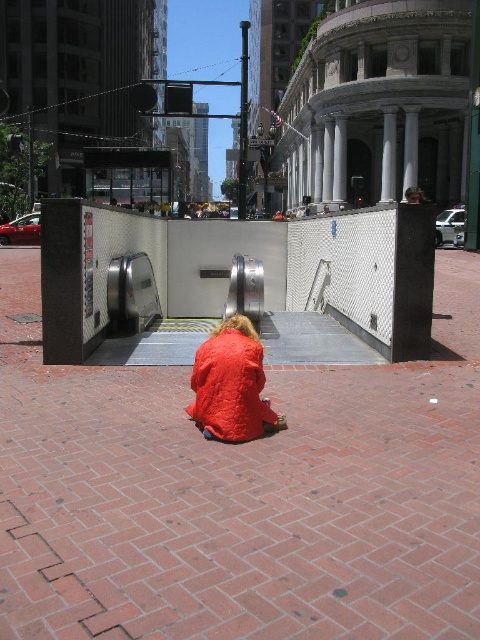
Which is below, brick pavement at center or quilted orange coat at center?

Positioned lower is brick pavement at center.

The width and height of the screenshot is (480, 640). What do you see at coordinates (240, 496) in the screenshot?
I see `brick pavement at center` at bounding box center [240, 496].

Is point (207, 488) positioned behind point (224, 332)?

No.

Find the location of a particular element. The width and height of the screenshot is (480, 640). brick pavement at center is located at coordinates (240, 496).